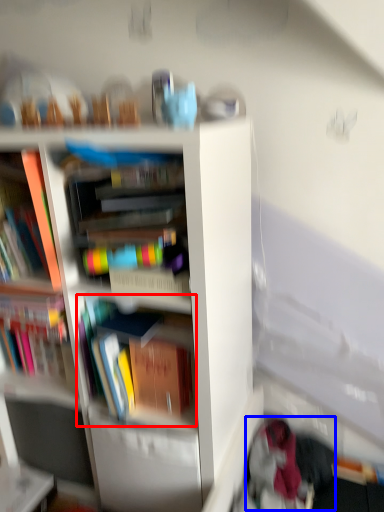
Question: Which of the following is the farthest to the observer, book (highlighted by a red box) or clothing (highlighted by a blue box)?

Choices:
 (A) book
 (B) clothing

Answer: (B)